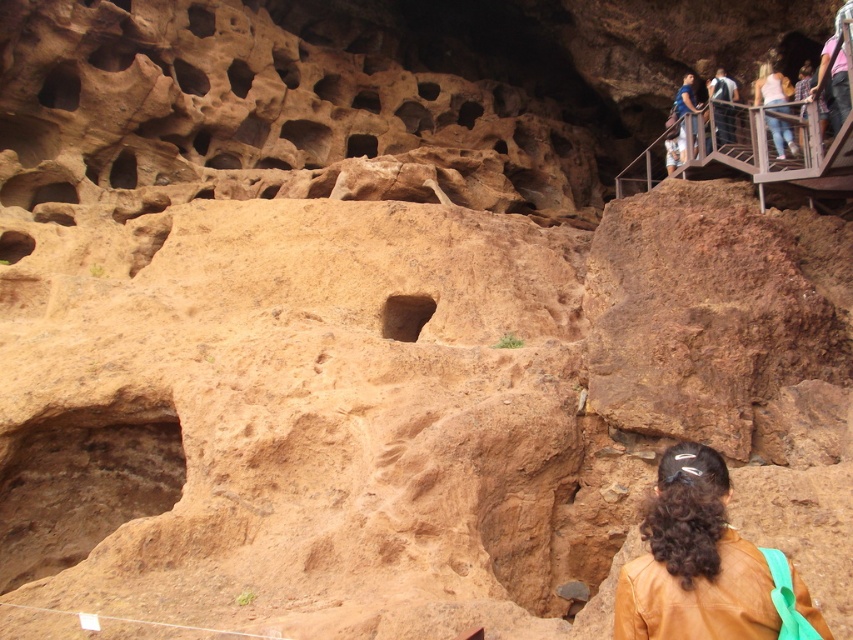
From the picture: Who is higher up, brown leather jacket at lower right or white cotton shirt at upper right?

Positioned higher is white cotton shirt at upper right.

Between point (672, 547) and point (722, 108), which one is positioned in front?

Point (672, 547) is more forward.

Locate an element on the screen. The width and height of the screenshot is (853, 640). brown leather jacket at lower right is located at coordinates (695, 561).

Find the location of `brown rough cave at lower left`. brown rough cave at lower left is located at coordinates (83, 483).

Between point (700, 520) and point (693, 147), which one is positioned in front?

Point (700, 520) is in front.

Can you confirm if brown leather jacket at lower right is shorter than blue denim jeans at upper right?

Yes.

Between point (762, 627) and point (672, 106), which one is positioned behind?

The point (672, 106) is behind.

Find the location of `brown leather jacket at lower right`. brown leather jacket at lower right is located at coordinates (695, 561).